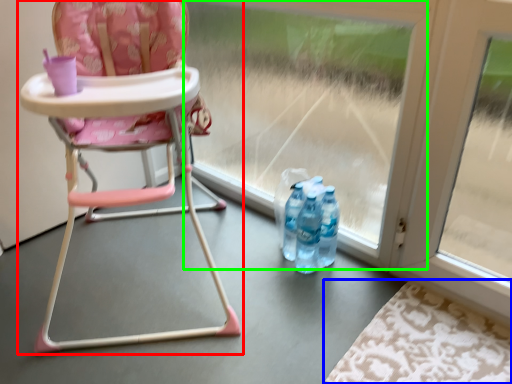
Question: Estimate the real-world distances between objects in this image. Which object is closer to chair (highlighted by a red box), mat (highlighted by a blue box) or glass door (highlighted by a green box)?

Choices:
 (A) mat
 (B) glass door

Answer: (B)